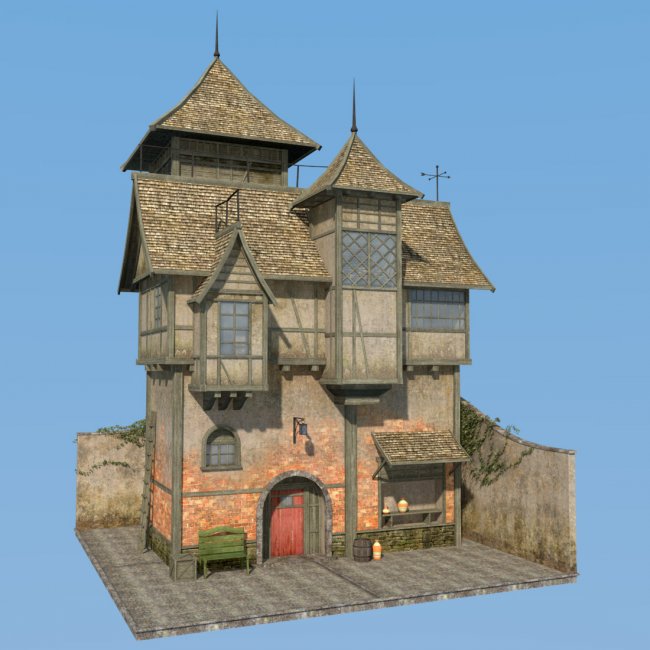
Locate an element on the screen. Image resolution: width=650 pixels, height=650 pixels. bench is located at coordinates (235, 540).